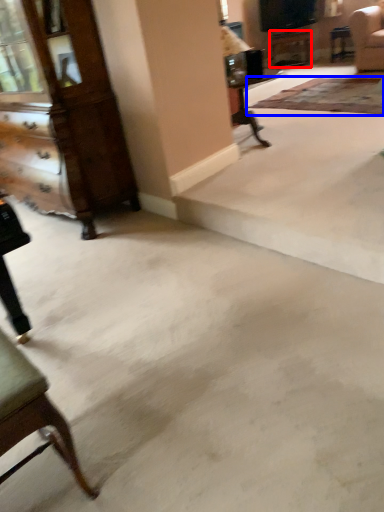
Question: Which object is further to the camera taking this photo, table (highlighted by a red box) or mat (highlighted by a blue box)?

Choices:
 (A) table
 (B) mat

Answer: (A)